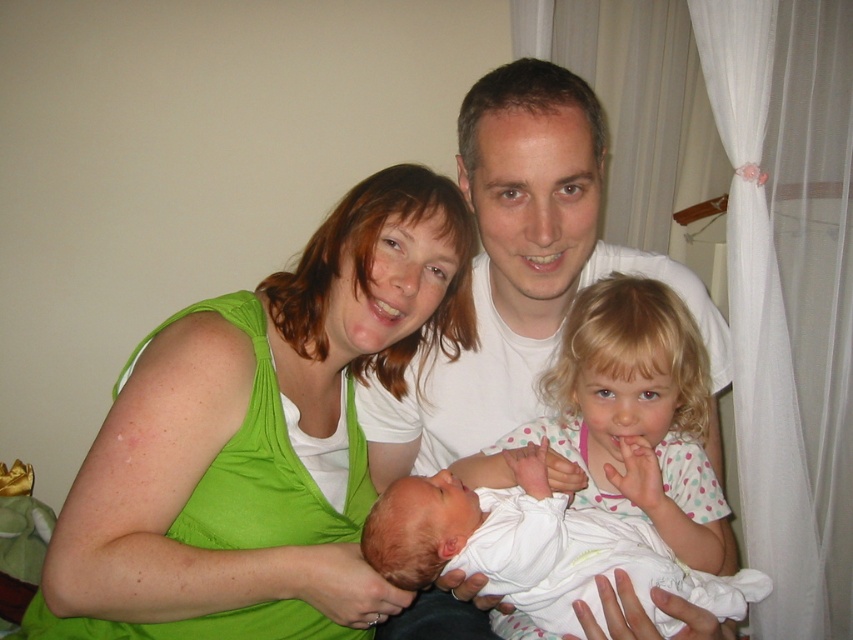
Who is positioned more to the left, white dotted shirt at center or white soft fabric newborn at center?

From the viewer's perspective, white soft fabric newborn at center appears more on the left side.

What do you see at coordinates (625, 417) in the screenshot?
I see `white dotted shirt at center` at bounding box center [625, 417].

I want to click on white dotted shirt at center, so click(x=625, y=417).

Identify the location of white dotted shirt at center. This screenshot has width=853, height=640. click(625, 417).

Can you confirm if green fabric at center is bigger than white soft fabric newborn at center?

Correct, green fabric at center is larger in size than white soft fabric newborn at center.

Is point (204, 456) behind point (376, 541)?

Yes, it is behind point (376, 541).

You are a GUI agent. You are given a task and a screenshot of the screen. Output one action in this format:
    pyautogui.click(x=<x>, y=<y>)
    Task: Click on the green fabric at center
    
    Given the screenshot: What is the action you would take?
    pyautogui.click(x=258, y=436)

The height and width of the screenshot is (640, 853). I want to click on green fabric at center, so click(258, 436).

Is green fabric at center shorter than white smooth shirt at center?

Indeed, green fabric at center has a lesser height compared to white smooth shirt at center.

In the scene shown: Is green fabric at center further to the viewer compared to white smooth shirt at center?

Yes, it is.

Between point (294, 337) and point (490, 371), which one is positioned in front?

Positioned in front is point (294, 337).

Locate an element on the screen. green fabric at center is located at coordinates (258, 436).